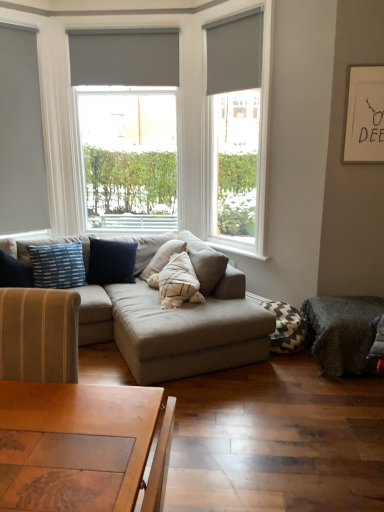
Question: From the image's perspective, is matte gray blind at upper center, which is the second blind from right to left, positioned above or below gray matte roller blind at left, placed as the first window when sorted from left to right?

Choices:
 (A) above
 (B) below

Answer: (A)

Question: From a real-world perspective, is matte gray blind at upper center, the 1th blind from the left, above or below gray matte roller blind at left, the 3th window when ordered from right to left?

Choices:
 (A) above
 (B) below

Answer: (A)

Question: Which of these objects is positioned farthest from the white painted wood at center?

Choices:
 (A) matte gray blind at upper right, acting as the 1th blind starting from the right
 (B) dark gray plush footrest at lower right
 (C) matte gray roller shade at upper right, placed as the first window when sorted from right to left
 (D) white paper at upper right
 (E) chevron-patterned fabric pillow at lower right, the second pillow in the top-to-bottom sequence

Answer: (A)

Question: Which of these objects is positioned closest to the matte gray blind at upper center, which is the second blind from right to left?

Choices:
 (A) white paper at upper right
 (B) white painted wood at center
 (C) matte gray couch at center
 (D) matte gray blind at upper right, the 2th blind from the back
 (E) gray matte roller blind at left, placed as the first window when sorted from left to right

Answer: (D)